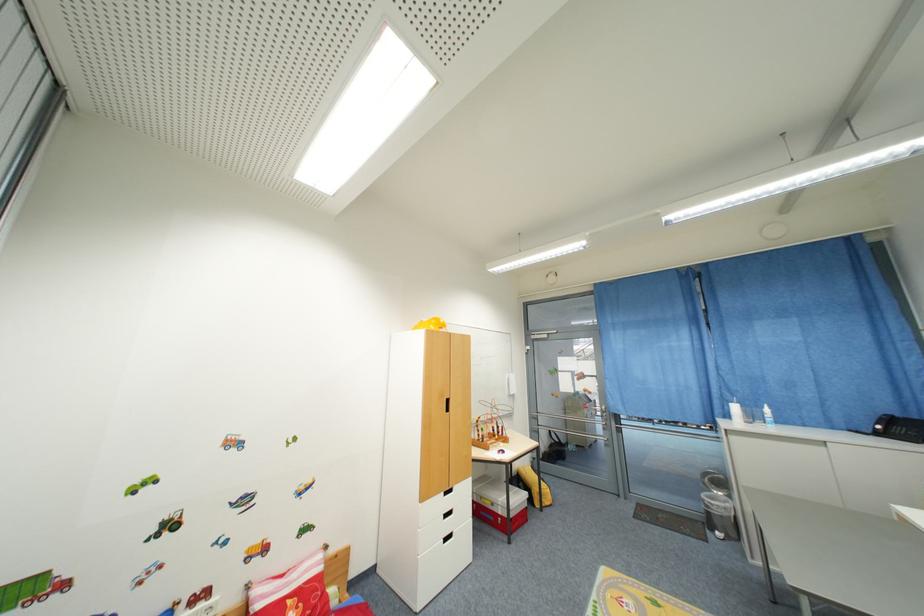
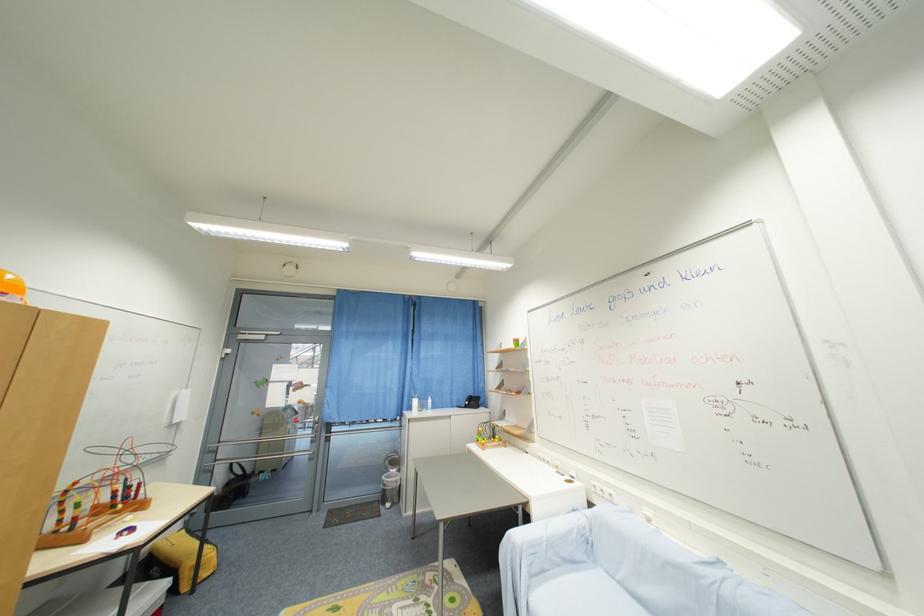
Question: Based on the continuous images, in which direction is the camera rotating? Reply with the corresponding letter.

Choices:
 (A) Left
 (B) Right
 (C) Up
 (D) Down

Answer: (B)